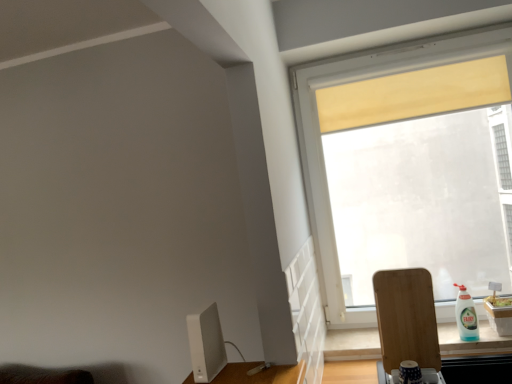
Question: Would you say white matte computer monitor at lower left is to the left or to the right of white plastic bottle at right in the picture?

Choices:
 (A) right
 (B) left

Answer: (B)

Question: In the image, is white matte computer monitor at lower left positioned in front of or behind white plastic bottle at right?

Choices:
 (A) front
 (B) behind

Answer: (A)

Question: Based on their relative distances, which object is farther from the transparent glass window at upper right?

Choices:
 (A) white plastic bottle at right
 (B) wooden cutting board at lower right
 (C) white matte computer monitor at lower left

Answer: (C)

Question: Which object is positioned closest to the wooden cutting board at lower right?

Choices:
 (A) white matte computer monitor at lower left
 (B) transparent glass window at upper right
 (C) white plastic bottle at right

Answer: (C)